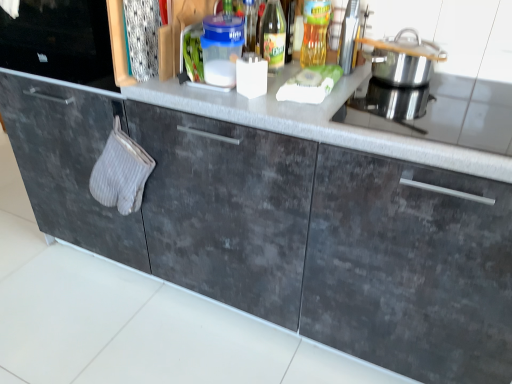
I want to click on vacant area that is in front of metallic silver toaster at upper right, so click(368, 94).